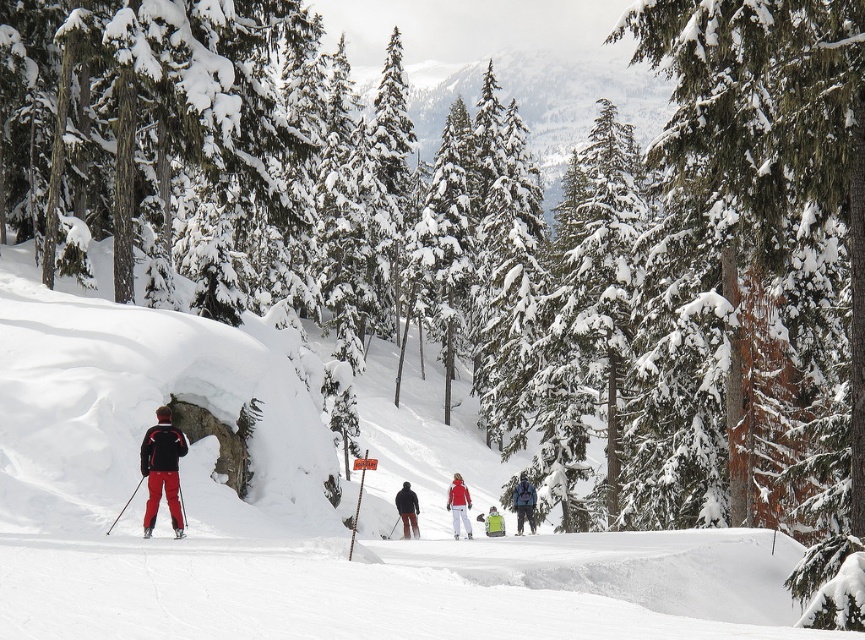
Question: Does matte black jacket at center have a greater width compared to matte red ski at lower left?

Choices:
 (A) yes
 (B) no

Answer: (B)

Question: Among these objects, which one is farthest from the camera?

Choices:
 (A) white snow ski slope at left
 (B) green fabric jacket at center

Answer: (B)

Question: Estimate the real-world distances between objects in this image. Which object is farther from the green fabric jacket at center?

Choices:
 (A) matte black jacket at left
 (B) matte black jacket at center
 (C) green fabric backpack at center
 (D) matte red ski at lower left

Answer: (D)

Question: Which object is positioned closest to the matte red snowsuit at center?

Choices:
 (A) green fabric backpack at center
 (B) green fabric jacket at center

Answer: (B)

Question: Is green fabric backpack at center to the left of green fabric jacket at center from the viewer's perspective?

Choices:
 (A) yes
 (B) no

Answer: (B)

Question: Does matte black jacket at center have a greater width compared to green fabric jacket at center?

Choices:
 (A) yes
 (B) no

Answer: (B)